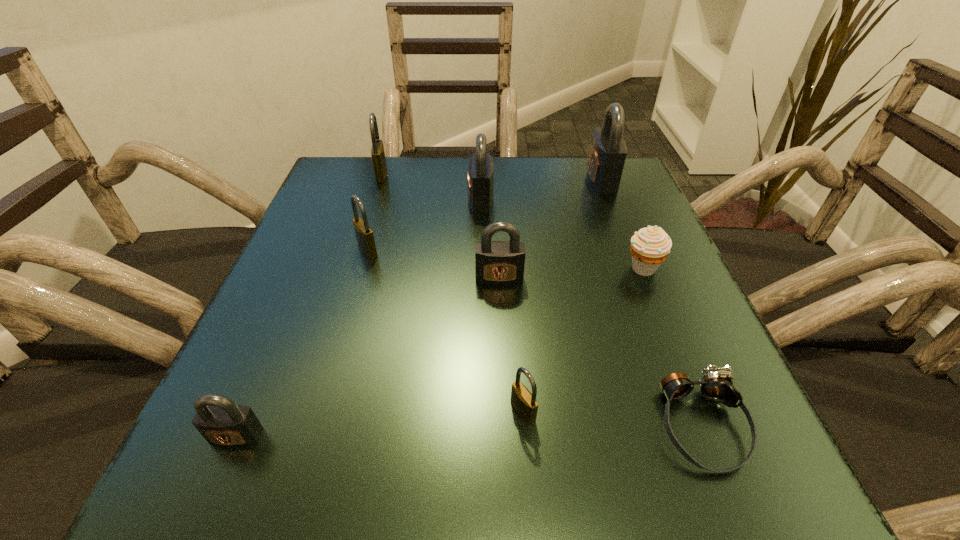
You are a GUI agent. You are given a task and a screenshot of the screen. Output one action in this format:
    pyautogui.click(x=<x>, y=<y>)
    Task: Click on the padlock that can be found as the closest to the second nearest gray padlock
    The image size is (960, 540).
    Given the screenshot: What is the action you would take?
    pyautogui.click(x=480, y=177)

Identify which gray padlock is the nearest to the muffin. Please provide its 2D coordinates. Your answer should be formatted as a tuple, i.e. [(x, y)], where the tuple contains the x and y coordinates of a point satisfying the conditions above.

[(497, 262)]

Find the location of a particular element. This screenshot has width=960, height=540. the closest gray padlock relative to the leftmost padlock is located at coordinates (497, 262).

I want to click on brass padlock that is the nearest to the bronze goggles, so click(524, 403).

Choose which brass padlock is the nearest neighbor to the biggest brass padlock. Please provide its 2D coordinates. Your answer should be formatted as a tuple, i.e. [(x, y)], where the tuple contains the x and y coordinates of a point satisfying the conditions above.

[(364, 234)]

Image resolution: width=960 pixels, height=540 pixels. Find the location of `vacant space that satisfies the following two spatial constraints: 1. on the front of the third smallest gray padlock near the keyhole; 2. on the front of the leftmost gray padlock near the keyhole`. vacant space that satisfies the following two spatial constraints: 1. on the front of the third smallest gray padlock near the keyhole; 2. on the front of the leftmost gray padlock near the keyhole is located at coordinates (481, 436).

Where is `free point that satisfies the following two spatial constraints: 1. on the front of the tallest padlock near the keyhole; 2. on the front of the leftmost gray padlock near the keyhole`? The image size is (960, 540). free point that satisfies the following two spatial constraints: 1. on the front of the tallest padlock near the keyhole; 2. on the front of the leftmost gray padlock near the keyhole is located at coordinates (700, 436).